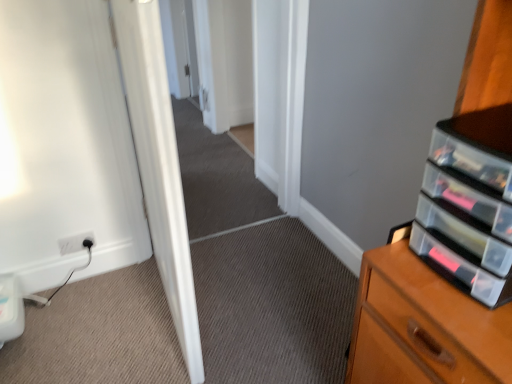
Question: Is the position of white glossy door at center more distant than that of white plastic electric outlet at lower left?

Choices:
 (A) no
 (B) yes

Answer: (A)

Question: Is white glossy door at center facing towards white plastic electric outlet at lower left?

Choices:
 (A) yes
 (B) no

Answer: (A)

Question: Can you confirm if white glossy door at center is shorter than white plastic electric outlet at lower left?

Choices:
 (A) no
 (B) yes

Answer: (A)

Question: Is white glossy door at center not inside white plastic electric outlet at lower left?

Choices:
 (A) no
 (B) yes

Answer: (B)

Question: Is white glossy door at center oriented away from white plastic electric outlet at lower left?

Choices:
 (A) no
 (B) yes

Answer: (A)

Question: Is clear plastic drawers at right to the left or to the right of white glossy door at center in the image?

Choices:
 (A) right
 (B) left

Answer: (A)

Question: From the image's perspective, relative to white glossy door at center, is clear plastic drawers at right above or below?

Choices:
 (A) below
 (B) above

Answer: (A)

Question: Relative to white glossy door at center, is clear plastic drawers at right in front or behind?

Choices:
 (A) behind
 (B) front

Answer: (B)

Question: Considering the positions of point (445, 172) and point (140, 124), is point (445, 172) closer or farther from the camera than point (140, 124)?

Choices:
 (A) farther
 (B) closer

Answer: (B)

Question: From the image's perspective, is white glossy door at center positioned above or below clear plastic drawers at right?

Choices:
 (A) below
 (B) above

Answer: (B)

Question: From a real-world perspective, is white glossy door at center above or below clear plastic drawers at right?

Choices:
 (A) above
 (B) below

Answer: (B)

Question: Which is correct: white glossy door at center is inside clear plastic drawers at right, or outside of it?

Choices:
 (A) inside
 (B) outside

Answer: (B)

Question: Is point (143, 100) closer or farther from the camera than point (504, 228)?

Choices:
 (A) farther
 (B) closer

Answer: (A)

Question: Considering the positions of white plastic electric outlet at lower left and clear plastic drawers at right in the image, is white plastic electric outlet at lower left taller or shorter than clear plastic drawers at right?

Choices:
 (A) short
 (B) tall

Answer: (A)

Question: Would you say white plastic electric outlet at lower left is to the left or to the right of clear plastic drawers at right in the picture?

Choices:
 (A) right
 (B) left

Answer: (B)